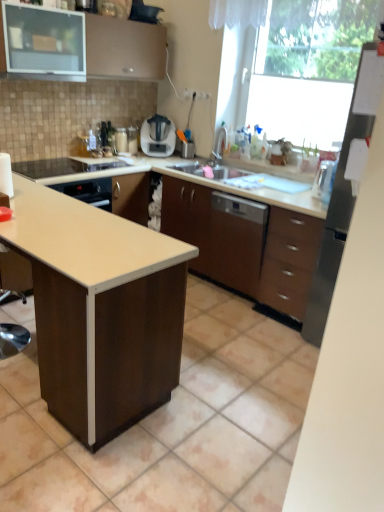
In order to click on free point to the right of white laminate table at center in this screenshot , I will do `click(232, 385)`.